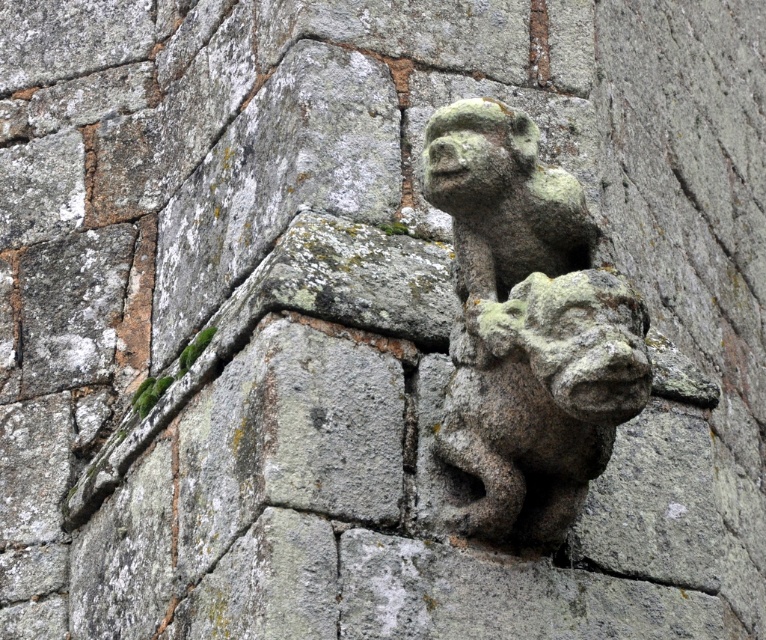
You are an architect examining the stone wall and notice two green mossy stone gargoyles. Which one is positioned higher up on the wall? The green mossy stone gargoyle at center or the green mossy stone gargoyle at upper center?

The green mossy stone gargoyle at upper center is positioned higher up on the wall compared to the green mossy stone gargoyle at center.

You are an architect inspecting a historic building. You notice a point at coordinates (526, 330) on the wall. According to the image, what is located at that point?

The point at coordinates (526, 330) marks the green mossy stone gargoyle at center.